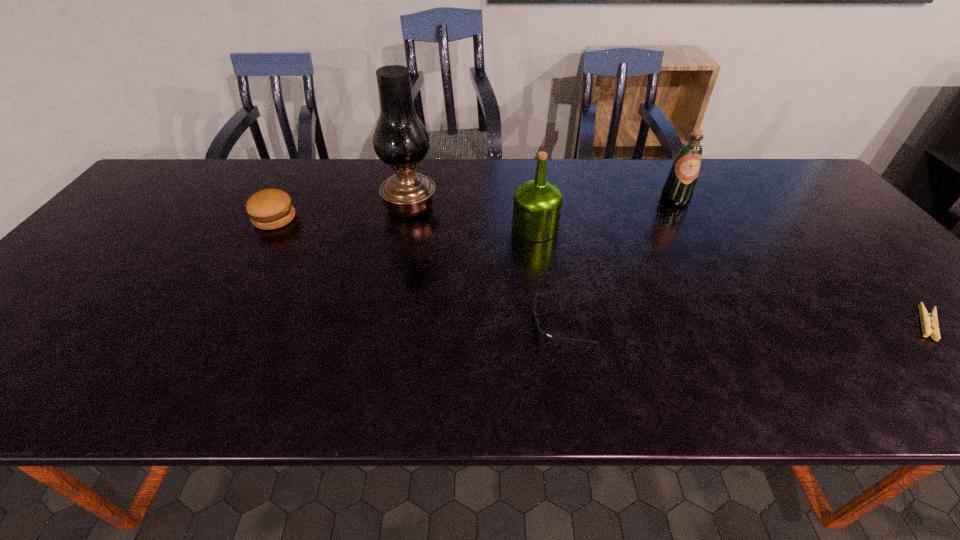
Identify the location of free space in the image that satisfies the following two spatial constraints: 1. on the front-facing side of the right olive oil; 2. on the front-facing side of the fifth tallest object. (743, 322).